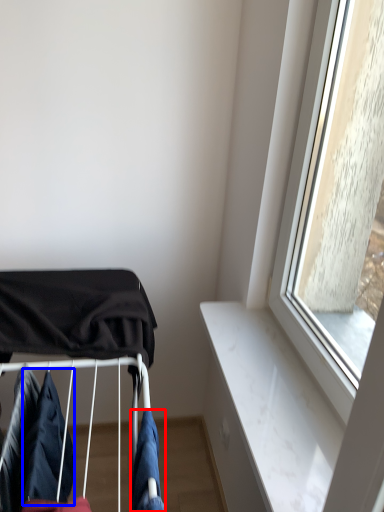
Question: Which point is further to the camera, clothing (highlighted by a red box) or clothing (highlighted by a blue box)?

Choices:
 (A) clothing
 (B) clothing

Answer: (B)